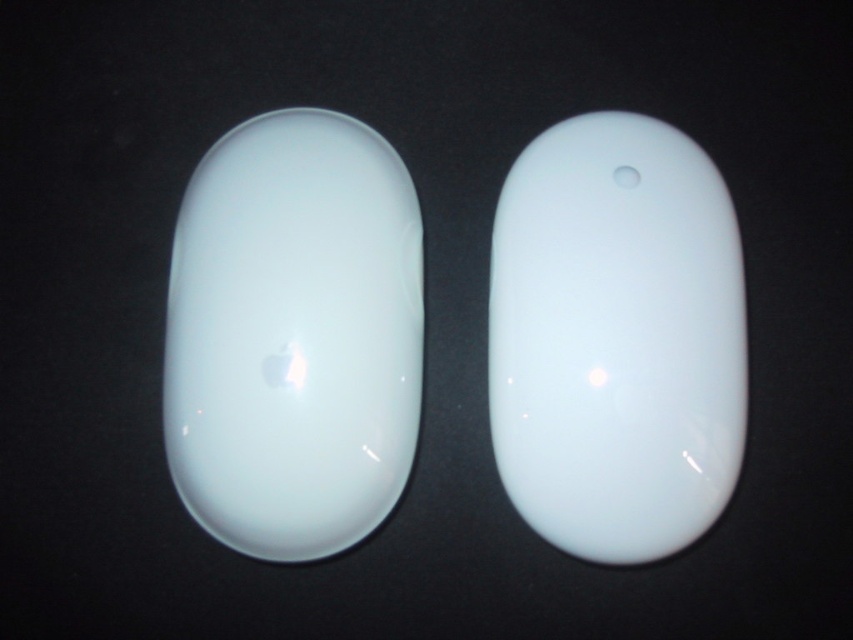
You are designing a custom mousepad and need to know the width of the glossy white mouse at left and the glossy white mouse at center to ensure proper fit. According to the image description, which mouse has a greater width?

The glossy white mouse at left might be wider than the glossy white mouse at center.

You are taking a photo of the glossy white mouse at left. If you want to capture it clearly, should you adjust your camera to focus on objects closer than 1 meter or farther than 1 meter?

The glossy white mouse at left is 1.15 meters from the camera, so you should adjust the camera to focus on objects farther than 1 meter to capture it clearly.

You are setting up a desk and want to arrange two glossy white mice. You have the glossy white mouse at left and the glossy white mouse at center. If you want to place them so that one is higher than the other, which mouse should you position higher?

The glossy white mouse at left should be positioned higher because it is located above the glossy white mouse at center.